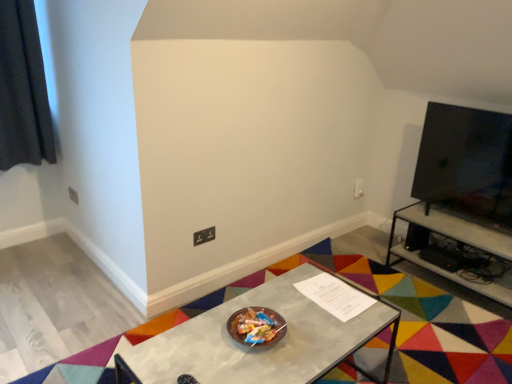
In order to click on free space above metallic gray table at right, placed as the 2th table when sorted from front to back (from a real-world perspective) in this screenshot , I will do `click(475, 227)`.